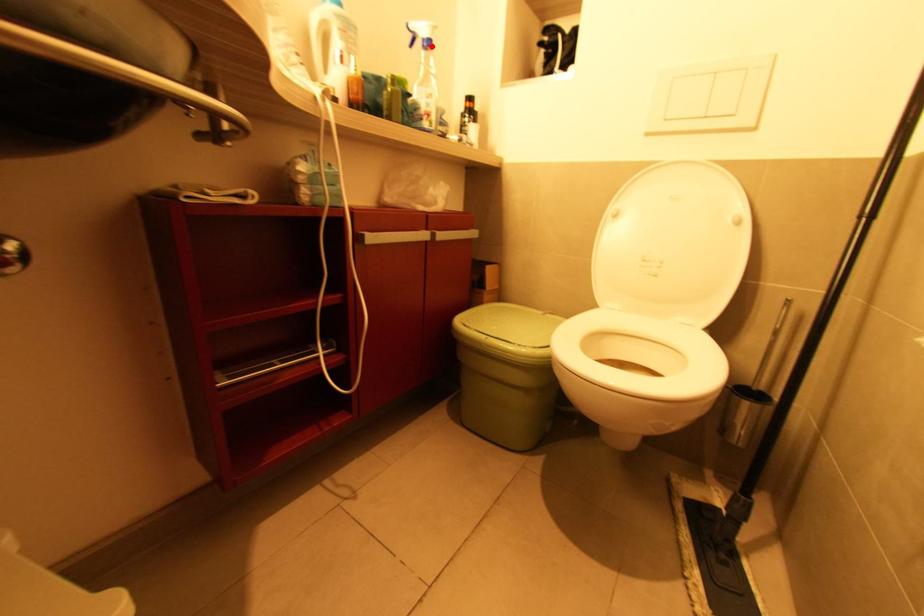
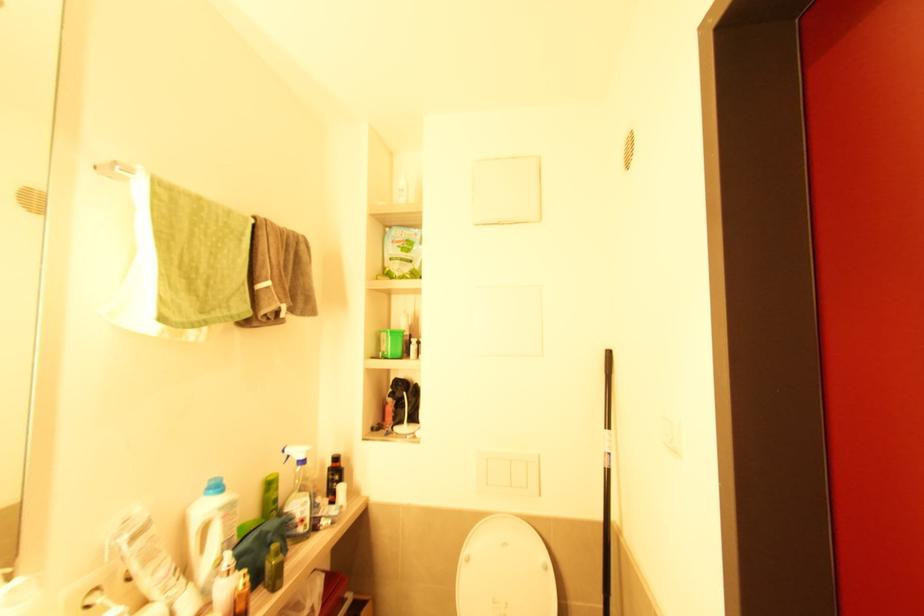
Question: I am providing you with two images of the same scene from different viewpoints. A red point is marked on the first image. Is the red point's position out of view in image 2?

Choices:
 (A) Yes
 (B) No

Answer: (B)